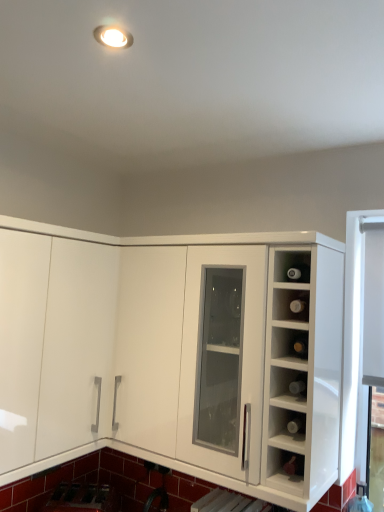
Question: Does metallic silver sink at lower left have a greater height compared to matte glass wine bottle at upper right?

Choices:
 (A) no
 (B) yes

Answer: (B)

Question: Considering the relative sizes of metallic silver sink at lower left and matte glass wine bottle at upper right in the image provided, is metallic silver sink at lower left thinner than matte glass wine bottle at upper right?

Choices:
 (A) yes
 (B) no

Answer: (B)

Question: Are metallic silver sink at lower left and matte glass wine bottle at upper right making contact?

Choices:
 (A) yes
 (B) no

Answer: (B)

Question: Are metallic silver sink at lower left and matte glass wine bottle at upper right located far from each other?

Choices:
 (A) no
 (B) yes

Answer: (B)

Question: Is matte glass wine bottle at upper right a part of metallic silver sink at lower left?

Choices:
 (A) no
 (B) yes

Answer: (A)

Question: From the image's perspective, is metallic silver sink at lower left positioned above or below transparent glass bottles at right?

Choices:
 (A) above
 (B) below

Answer: (B)

Question: Considering the positions of point (61, 503) and point (289, 401), is point (61, 503) closer or farther from the camera than point (289, 401)?

Choices:
 (A) closer
 (B) farther

Answer: (B)

Question: Is metallic silver sink at lower left wider or thinner than transparent glass bottles at right?

Choices:
 (A) wide
 (B) thin

Answer: (A)

Question: Is metallic silver sink at lower left bigger or smaller than transparent glass bottles at right?

Choices:
 (A) big
 (B) small

Answer: (A)

Question: Looking at the image, does transparent glass bottles at right seem bigger or smaller compared to matte glass wine bottle at upper right?

Choices:
 (A) big
 (B) small

Answer: (A)

Question: Looking at their shapes, would you say transparent glass bottles at right is wider or thinner than matte glass wine bottle at upper right?

Choices:
 (A) thin
 (B) wide

Answer: (B)

Question: Is transparent glass bottles at right in front of or behind matte glass wine bottle at upper right in the image?

Choices:
 (A) behind
 (B) front

Answer: (B)

Question: From a real-world perspective, relative to matte glass wine bottle at upper right, is transparent glass bottles at right vertically above or below?

Choices:
 (A) below
 (B) above

Answer: (A)

Question: Would you say white glossy cabinet at center is inside or outside metallic silver sink at lower left?

Choices:
 (A) outside
 (B) inside

Answer: (A)

Question: In terms of size, does white glossy cabinet at center appear bigger or smaller than metallic silver sink at lower left?

Choices:
 (A) big
 (B) small

Answer: (A)